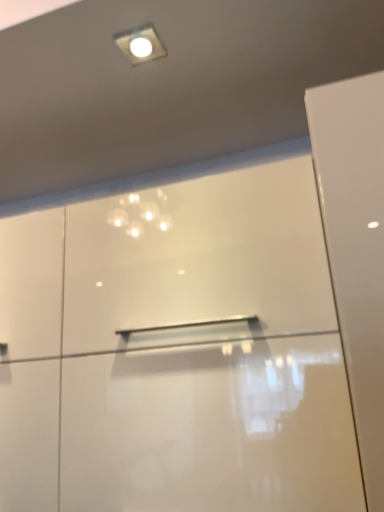
This screenshot has width=384, height=512. In order to click on vacant space to the right of white glossy droplight at upper center in this screenshot , I will do pos(209,46).